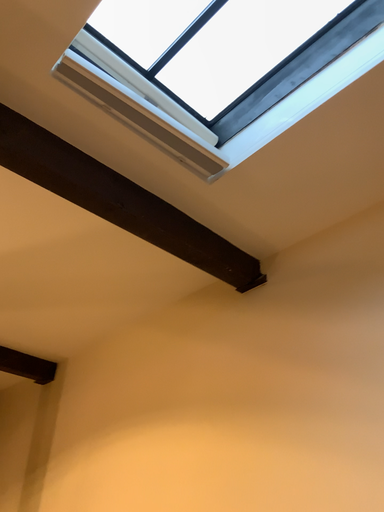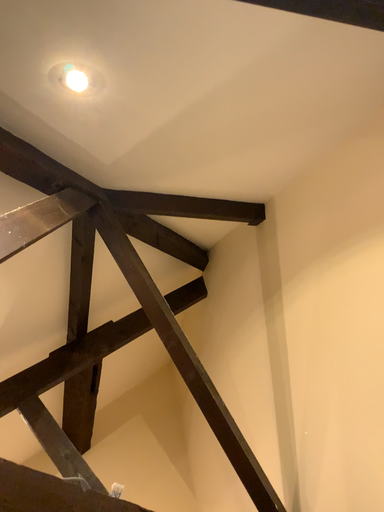
Question: Which way did the camera rotate in the video?

Choices:
 (A) rotated left
 (B) rotated right

Answer: (A)